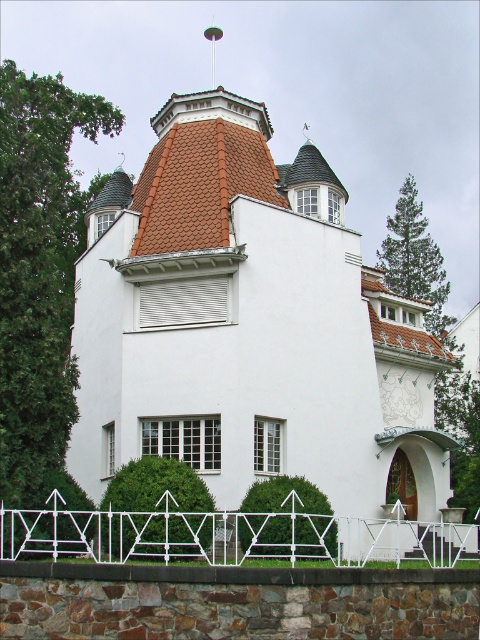
Does white smooth house at center have a greater width compared to white metal fence at lower center?

Yes.

Does white smooth house at center have a lesser width compared to white metal fence at lower center?

Incorrect, white smooth house at center's width is not less than white metal fence at lower center's.

Which is in front, point (115, 384) or point (323, 529)?

Point (323, 529) is in front.

Locate an element on the screen. white smooth house at center is located at coordinates (255, 337).